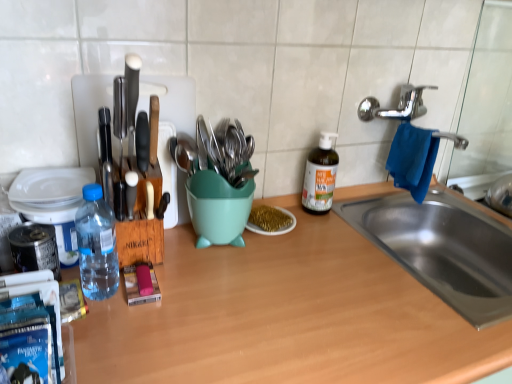
At what (x,y) coordinates should I click in order to perform the action: click on free space in front of green glass bottle at center, placed as the second bottle when sorted from left to right. Please return your answer as a coordinate pair (x, y). Looking at the image, I should click on (330, 245).